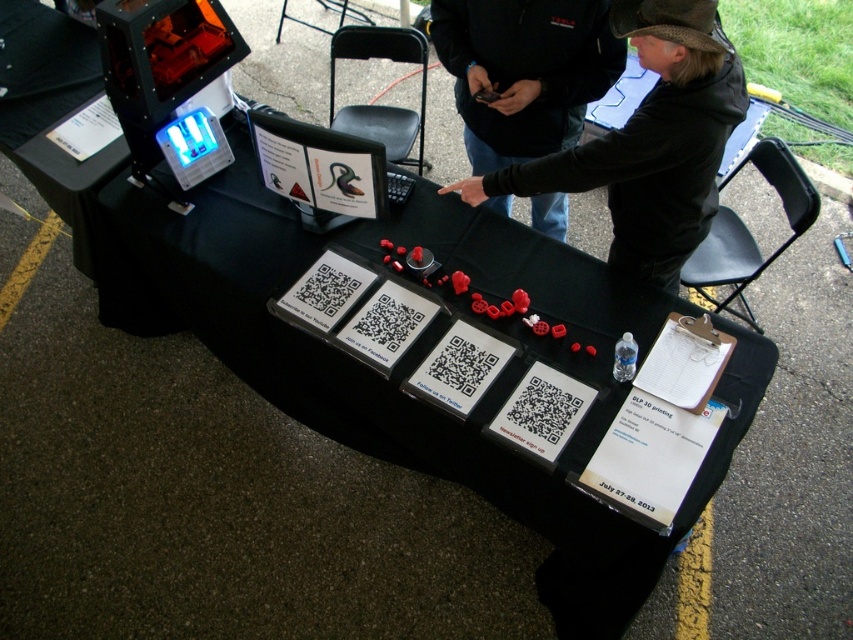
You are organizing an outdoor event and need to place two black leather jackets on a table. You have a space constraint where the jacket at upper center must be smaller than the one at center. Can the current arrangement of the black leather jacket at upper center and the black leather jacket at center meet this requirement?

The black leather jacket at upper center is bigger than the black leather jacket at center, so the current arrangement does not meet the requirement since the jacket at upper center is larger than the one at center.

You are standing in front of the table and want to place a small sticker on the point that is closer to you. Which point should you choose between point (647, 227) and point (482, 68)?

You should choose point (647, 227) because it is closer to you than point (482, 68).